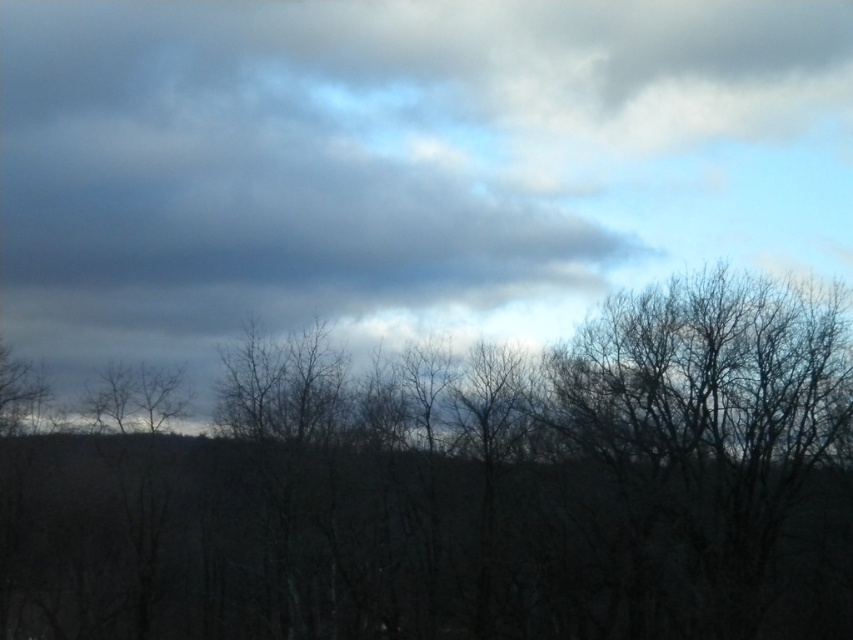
Question: Is cloudy sky at upper center further to camera compared to brown/rough tree at center?

Choices:
 (A) yes
 (B) no

Answer: (A)

Question: Can you confirm if cloudy sky at upper center is thinner than brown/rough tree at center?

Choices:
 (A) yes
 (B) no

Answer: (B)

Question: Can you confirm if cloudy sky at upper center is positioned below brown/rough tree at center?

Choices:
 (A) yes
 (B) no

Answer: (B)

Question: Which point is farther to the camera?

Choices:
 (A) (198, 508)
 (B) (306, 276)

Answer: (B)

Question: Which point is closer to the camera?

Choices:
 (A) cloudy sky at upper center
 (B) brown/rough tree at center

Answer: (B)

Question: Among these points, which one is nearest to the camera?

Choices:
 (A) (154, 36)
 (B) (190, 561)

Answer: (B)